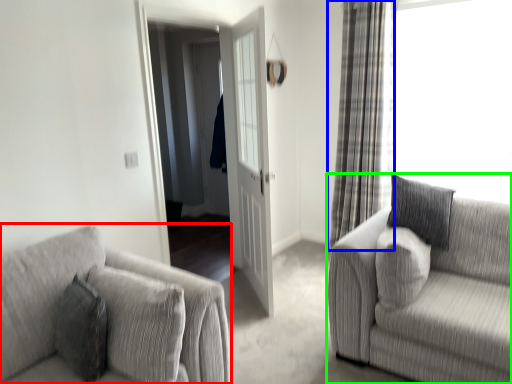
Question: Which is nearer to the studio couch (highlighted by a red box)? curtain (highlighted by a blue box) or studio couch (highlighted by a green box).

Choices:
 (A) curtain
 (B) studio couch

Answer: (B)